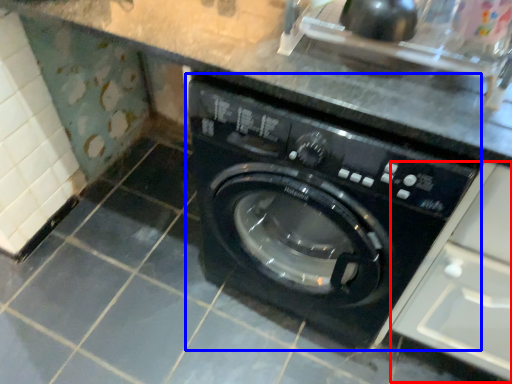
Question: Which of the following is the closest to the observer, drawer (highlighted by a red box) or washing machine (highlighted by a blue box)?

Choices:
 (A) drawer
 (B) washing machine

Answer: (A)